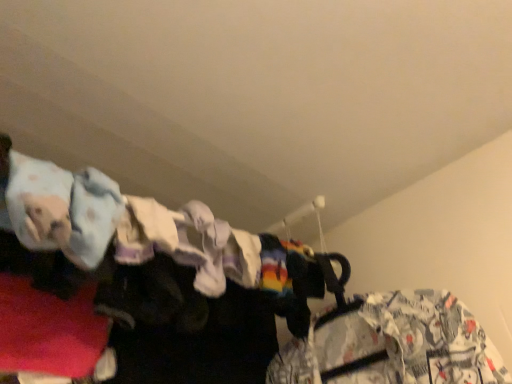
Question: Is point (359, 311) closer or farther from the camera than point (31, 238)?

Choices:
 (A) closer
 (B) farther

Answer: (B)

Question: From a real-world perspective, is white printed fabric at right, the 2th clothing viewed from the top, physically located above or below light blue fabric at upper left, acting as the second clothing starting from the bottom?

Choices:
 (A) below
 (B) above

Answer: (A)

Question: Considering the positions of white printed fabric at right, which is counted as the second clothing, starting from the left, and light blue fabric at upper left, the second clothing viewed from the right, in the image, is white printed fabric at right, which is counted as the second clothing, starting from the left, taller or shorter than light blue fabric at upper left, the second clothing viewed from the right,?

Choices:
 (A) tall
 (B) short

Answer: (A)

Question: Relative to white printed fabric at right, which is counted as the second clothing, starting from the left, is light blue fabric at upper left, the second clothing viewed from the right, in front or behind?

Choices:
 (A) front
 (B) behind

Answer: (A)

Question: From the image's perspective, is light blue fabric at upper left, which is counted as the 2th clothing, starting from the back, located above or below white printed fabric at right, the second clothing in the front-to-back sequence?

Choices:
 (A) below
 (B) above

Answer: (B)

Question: In the image, is light blue fabric at upper left, which is the 1th clothing in front-to-back order, on the left side or the right side of white printed fabric at right, the first clothing from the back?

Choices:
 (A) right
 (B) left

Answer: (B)

Question: Is light blue fabric at upper left, which is counted as the 2th clothing, starting from the back, situated inside white printed fabric at right, the first clothing from the back, or outside?

Choices:
 (A) outside
 (B) inside

Answer: (A)